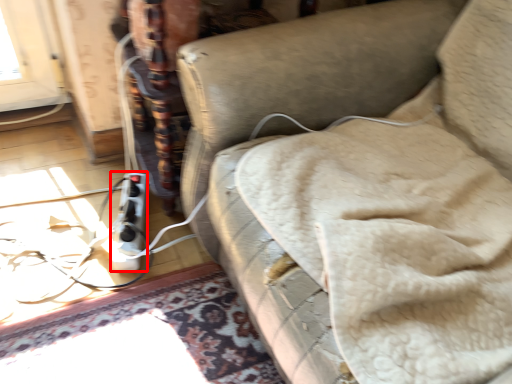
Question: From the image's perspective, where is extension cord (annotated by the red box) located relative to furniture?

Choices:
 (A) below
 (B) above

Answer: (A)